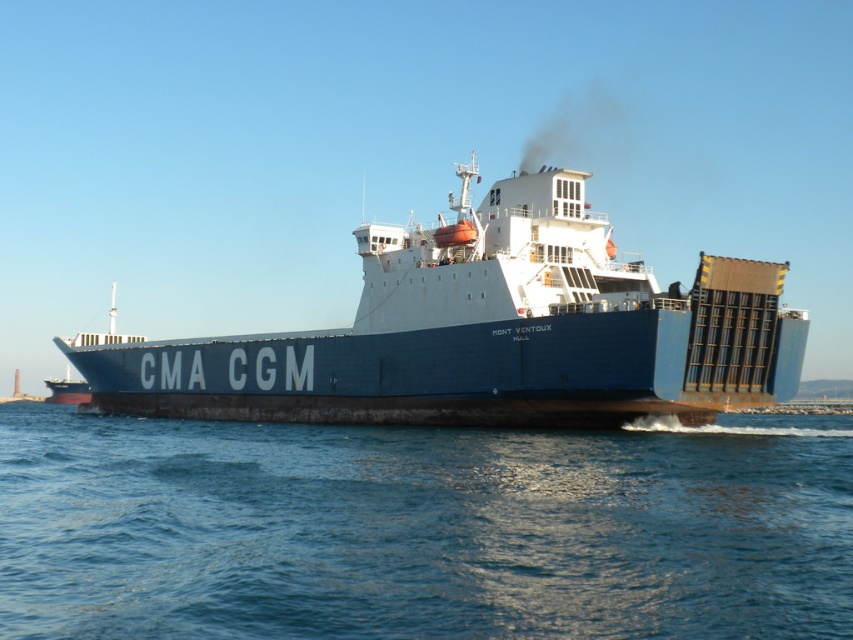
From the picture: You are standing on the deck of the CMA CGM Mont Ventoux cargo ship and see two points marked on the deck. The first point is at coordinate point (207, 556) and the second is at point (445, 266). Which point is closer to you?

Point (207, 556) is closer to the camera than point (445, 266), so the first point is closer to you.

You are standing on the deck of the CMA CGM Mont Ventoux cargo ship. You notice a point marked at coordinates (422, 529). Based on the scene description, where is this point located?

The point at coordinates (422, 529) is on the blue water at center.